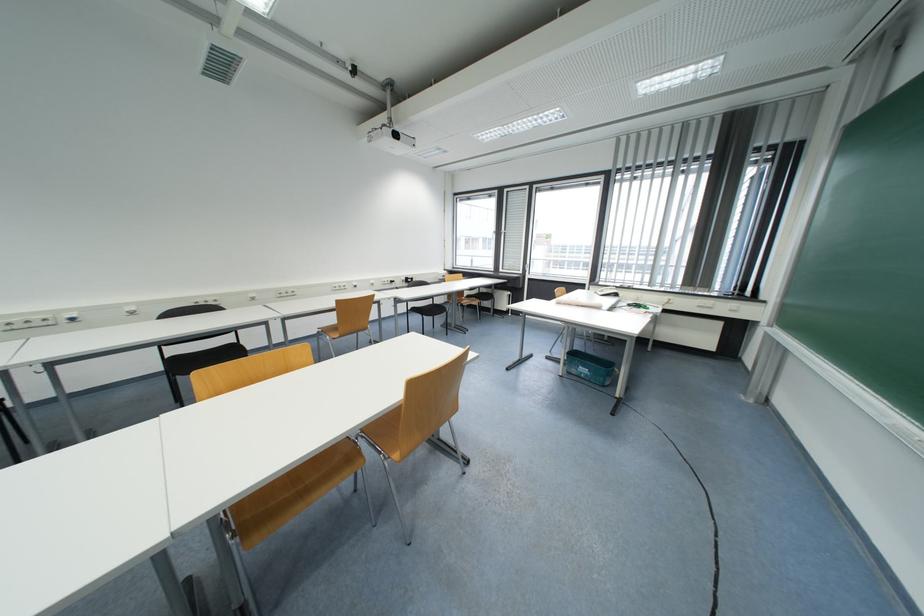
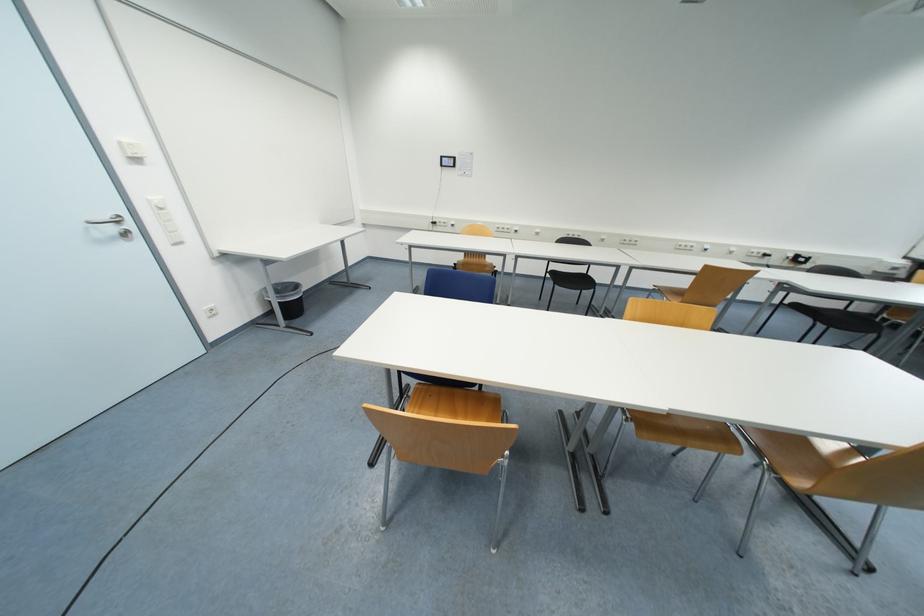
Where in the second image is the point corresponding to [138,314] from the first image?

(541, 236)